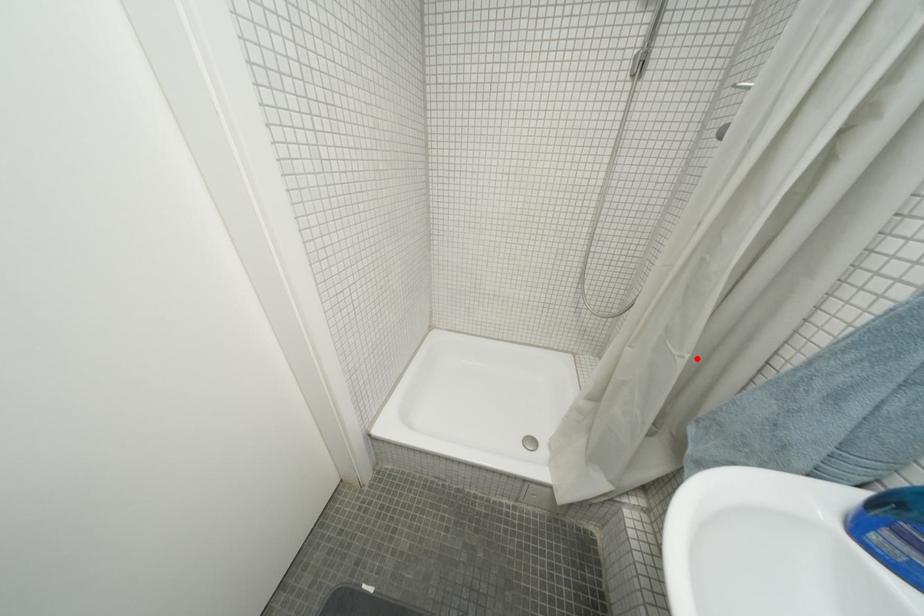
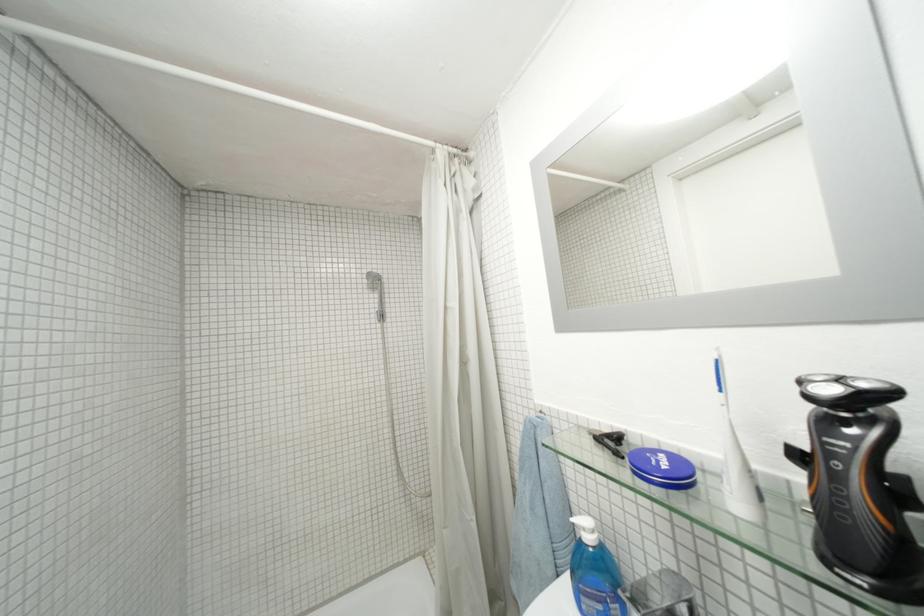
Question: I am providing you with two images of the same scene from different viewpoints. A red point is marked on the first image. Is the red point's position out of view in image 2?

Choices:
 (A) Yes
 (B) No

Answer: (B)